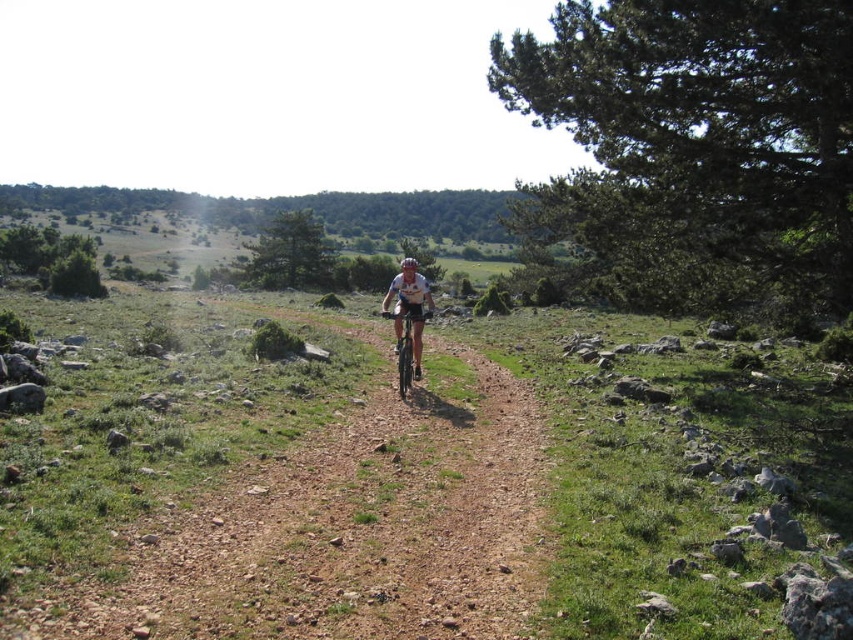
How much distance is there between white matte bicycle at center and shiny metallic bicycle at center?

The distance of white matte bicycle at center from shiny metallic bicycle at center is 25.61 inches.

Measure the distance between point [409,317] and camera.

The distance of point [409,317] from camera is 12.59 meters.

The width and height of the screenshot is (853, 640). In order to click on white matte bicycle at center in this screenshot , I will do pos(409,310).

You are a GUI agent. You are given a task and a screenshot of the screen. Output one action in this format:
    pyautogui.click(x=<x>, y=<y>)
    Task: Click on the white matte bicycle at center
    
    Given the screenshot: What is the action you would take?
    pyautogui.click(x=409, y=310)

The height and width of the screenshot is (640, 853). What are the coordinates of `shiny metallic bicycle at center` in the screenshot? It's located at (405, 348).

Between shiny metallic bicycle at center and white matte bicycle helmet at center, which one has less height?

shiny metallic bicycle at center

Describe the element at coordinates (405, 348) in the screenshot. The image size is (853, 640). I see `shiny metallic bicycle at center` at that location.

This screenshot has width=853, height=640. In order to click on shiny metallic bicycle at center in this screenshot , I will do `click(405, 348)`.

Is point (421, 358) positioned behind point (415, 259)?

No, it is in front of (415, 259).

Which is more to the right, white matte bicycle at center or white matte bicycle helmet at center?

white matte bicycle at center is more to the right.

The image size is (853, 640). What are the coordinates of `white matte bicycle at center` in the screenshot? It's located at (409, 310).